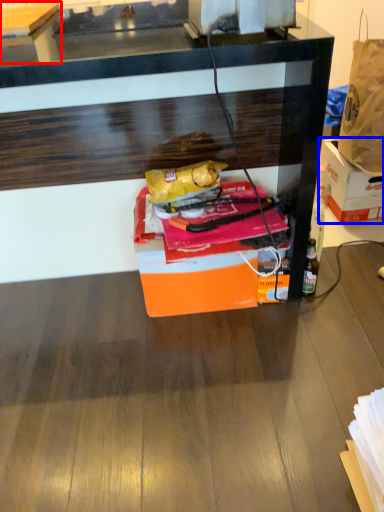
Question: Among these objects, which one is farthest to the camera, table (highlighted by a red box) or box (highlighted by a blue box)?

Choices:
 (A) table
 (B) box

Answer: (B)